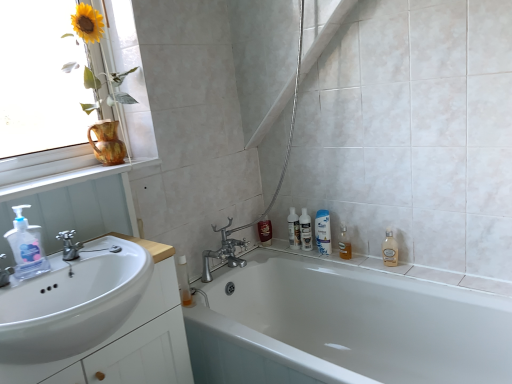
Question: Is matte ceramic vase at upper left smaller than white wood window sill at upper left?

Choices:
 (A) yes
 (B) no

Answer: (B)

Question: From a real-world perspective, is matte ceramic vase at upper left on top of white wood window sill at upper left?

Choices:
 (A) no
 (B) yes

Answer: (B)

Question: Can you confirm if matte ceramic vase at upper left is bigger than white wood window sill at upper left?

Choices:
 (A) yes
 (B) no

Answer: (A)

Question: From a real-world perspective, is matte ceramic vase at upper left positioned under white wood window sill at upper left based on gravity?

Choices:
 (A) yes
 (B) no

Answer: (B)

Question: Are matte ceramic vase at upper left and white wood window sill at upper left located far from each other?

Choices:
 (A) yes
 (B) no

Answer: (B)

Question: From a real-world perspective, is white glossy mouthwash at upper right, the second mouthwash in the right-to-left sequence, above or below white glossy bottles at center, acting as the 2th toiletry starting from the right?

Choices:
 (A) below
 (B) above

Answer: (B)

Question: Is white glossy mouthwash at upper right, the second mouthwash in the right-to-left sequence, inside or outside of white glossy bottles at center, the 2th toiletry viewed from the left?

Choices:
 (A) outside
 (B) inside

Answer: (A)

Question: From the image's perspective, relative to white glossy bottles at center, acting as the 2th toiletry starting from the right, is white glossy mouthwash at upper right, the second mouthwash in the right-to-left sequence, above or below?

Choices:
 (A) below
 (B) above

Answer: (A)

Question: From their relative heights in the image, would you say white glossy mouthwash at upper right, the second mouthwash in the right-to-left sequence, is taller or shorter than white glossy bottles at center, the 2th toiletry viewed from the left?

Choices:
 (A) short
 (B) tall

Answer: (B)

Question: Looking at the image, does chrome metallic faucet at sink left seem bigger or smaller compared to white glossy mouthwash at upper right, the second mouthwash in the right-to-left sequence?

Choices:
 (A) big
 (B) small

Answer: (B)

Question: In terms of width, does chrome metallic faucet at sink left look wider or thinner when compared to white glossy mouthwash at upper right, the first mouthwash when ordered from left to right?

Choices:
 (A) wide
 (B) thin

Answer: (A)

Question: Is chrome metallic faucet at sink left taller or shorter than white glossy mouthwash at upper right, the first mouthwash when ordered from left to right?

Choices:
 (A) tall
 (B) short

Answer: (B)

Question: Considering the positions of point (74, 258) and point (320, 225), is point (74, 258) closer or farther from the camera than point (320, 225)?

Choices:
 (A) farther
 (B) closer

Answer: (B)

Question: Is point (304, 236) closer or farther from the camera than point (392, 236)?

Choices:
 (A) closer
 (B) farther

Answer: (B)

Question: Considering the relative positions of translucent plastic bottles at center, which appears as the first toiletry when viewed from the right, and clear glass bottle at right, positioned as the second cleaning product in left-to-right order, in the image provided, is translucent plastic bottles at center, which appears as the first toiletry when viewed from the right, to the left or to the right of clear glass bottle at right, positioned as the second cleaning product in left-to-right order,?

Choices:
 (A) left
 (B) right

Answer: (A)